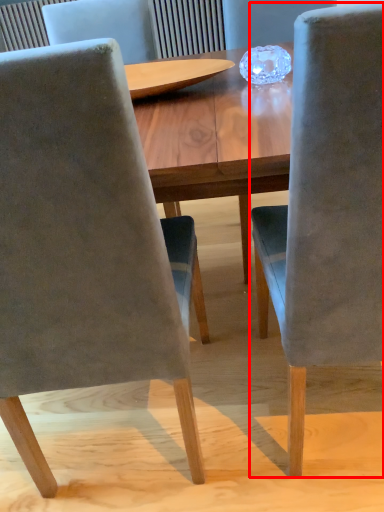
Question: From the image's perspective, what is the correct spatial positioning of chair (annotated by the red box) in reference to chair?

Choices:
 (A) above
 (B) below

Answer: (A)